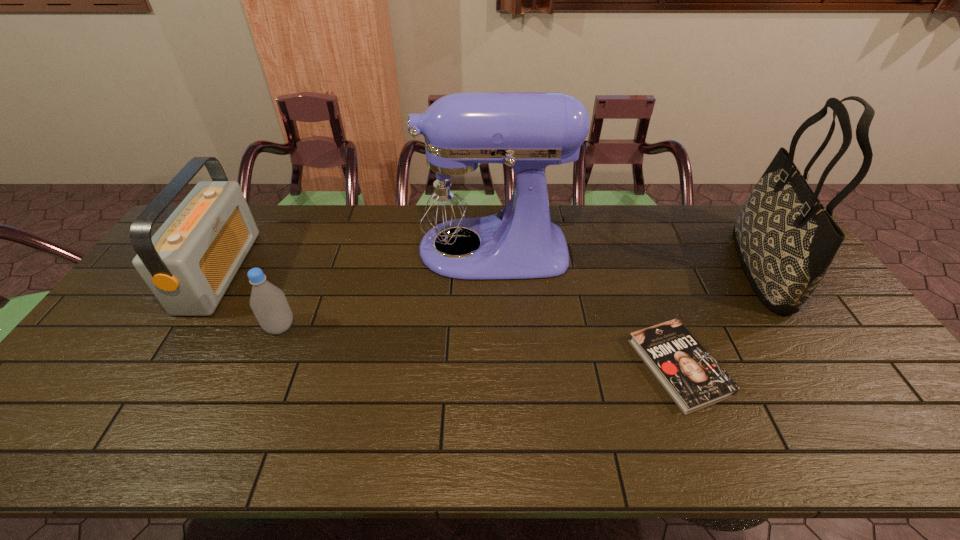
Locate an element on the screen. the rightmost object is located at coordinates (786, 240).

Locate an element on the screen. This screenshot has width=960, height=540. the third object from left to right is located at coordinates (455, 193).

Find the location of a particular element. The width and height of the screenshot is (960, 540). radio receiver is located at coordinates (189, 263).

Image resolution: width=960 pixels, height=540 pixels. In order to click on the third shortest object in this screenshot , I will do point(189,263).

In order to click on the second shortest object in this screenshot , I will do `click(268, 302)`.

Find the location of a particular element. The width and height of the screenshot is (960, 540). bottle is located at coordinates (268, 302).

Where is `the fourth object from left to right`? The image size is (960, 540). the fourth object from left to right is located at coordinates (694, 380).

Locate an element on the screen. This screenshot has height=540, width=960. the shortest object is located at coordinates (694, 380).

You are a GUI agent. You are given a task and a screenshot of the screen. Output one action in this format:
    pyautogui.click(x=<x>, y=<y>)
    Task: Click on the free space located on the back of the tote bag
    Image resolution: width=960 pixels, height=540 pixels.
    Given the screenshot: What is the action you would take?
    pyautogui.click(x=722, y=208)

Locate an element on the screen. Image resolution: width=960 pixels, height=540 pixels. blank area located at the mixing area of the mixer is located at coordinates (305, 249).